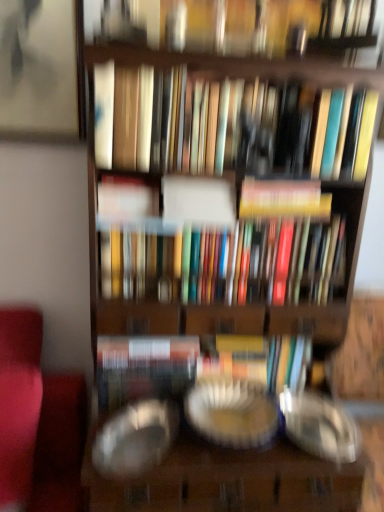
Question: Can you confirm if multicolored hardcover books at center, arranged as the first book when ordered from the bottom, is bigger than matte white book at center, which is the third book from bottom to top?

Choices:
 (A) yes
 (B) no

Answer: (A)

Question: Considering the relative positions of multicolored hardcover books at center, arranged as the first book when ordered from the bottom, and matte white book at center, which is the third book from bottom to top, in the image provided, is multicolored hardcover books at center, arranged as the first book when ordered from the bottom, to the right of matte white book at center, which is the third book from bottom to top, from the viewer's perspective?

Choices:
 (A) yes
 (B) no

Answer: (A)

Question: Is there a large distance between multicolored hardcover books at center, arranged as the fourth book when viewed from the top, and matte white book at center, acting as the second book starting from the top?

Choices:
 (A) yes
 (B) no

Answer: (B)

Question: Is multicolored hardcover books at center, arranged as the fourth book when viewed from the top, next to matte white book at center, which is the third book from bottom to top?

Choices:
 (A) no
 (B) yes

Answer: (A)

Question: Can you confirm if multicolored hardcover books at center, arranged as the fourth book when viewed from the top, is smaller than matte white book at center, acting as the second book starting from the top?

Choices:
 (A) no
 (B) yes

Answer: (A)

Question: Is multicolored hardcover books at center, arranged as the first book when ordered from the bottom, positioned beyond the bounds of matte white book at center, which is the third book from bottom to top?

Choices:
 (A) yes
 (B) no

Answer: (A)

Question: Does transparent glass plate at center, which ranks as the second glass plate in right-to-left order, have a smaller size compared to hardcover book at center, marked as the third book in a top-to-bottom arrangement?

Choices:
 (A) no
 (B) yes

Answer: (A)

Question: Is transparent glass plate at center, the 1th glass plate viewed from the left, at the right side of hardcover book at center, marked as the third book in a top-to-bottom arrangement?

Choices:
 (A) no
 (B) yes

Answer: (A)

Question: Can you confirm if transparent glass plate at center, which ranks as the second glass plate in right-to-left order, is shorter than hardcover book at center, positioned as the second book in bottom-to-top order?

Choices:
 (A) yes
 (B) no

Answer: (A)

Question: Is transparent glass plate at center, which ranks as the second glass plate in right-to-left order, closer to camera compared to hardcover book at center, marked as the third book in a top-to-bottom arrangement?

Choices:
 (A) yes
 (B) no

Answer: (A)

Question: Does transparent glass plate at center, which ranks as the second glass plate in right-to-left order, turn towards hardcover book at center, marked as the third book in a top-to-bottom arrangement?

Choices:
 (A) no
 (B) yes

Answer: (A)

Question: Considering the relative sizes of transparent glass plate at center, which ranks as the second glass plate in right-to-left order, and hardcover book at center, marked as the third book in a top-to-bottom arrangement, in the image provided, is transparent glass plate at center, which ranks as the second glass plate in right-to-left order, thinner than hardcover book at center, marked as the third book in a top-to-bottom arrangement,?

Choices:
 (A) yes
 (B) no

Answer: (B)

Question: Could you tell me if matte white book at center, which is the third book from bottom to top, is turned towards hardcover book at center, positioned as the second book in bottom-to-top order?

Choices:
 (A) yes
 (B) no

Answer: (B)